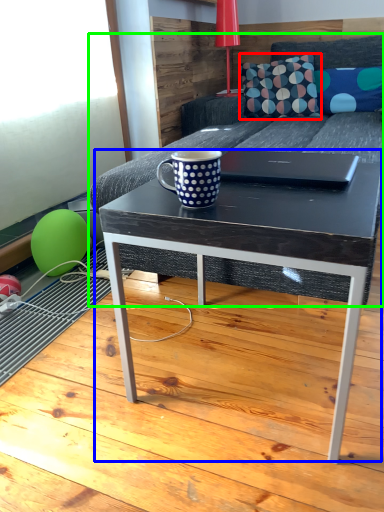
Question: Considering the real-world distances, which object is farthest from throw pillow (highlighted by a red box)? coffee table (highlighted by a blue box) or studio couch (highlighted by a green box)?

Choices:
 (A) coffee table
 (B) studio couch

Answer: (A)